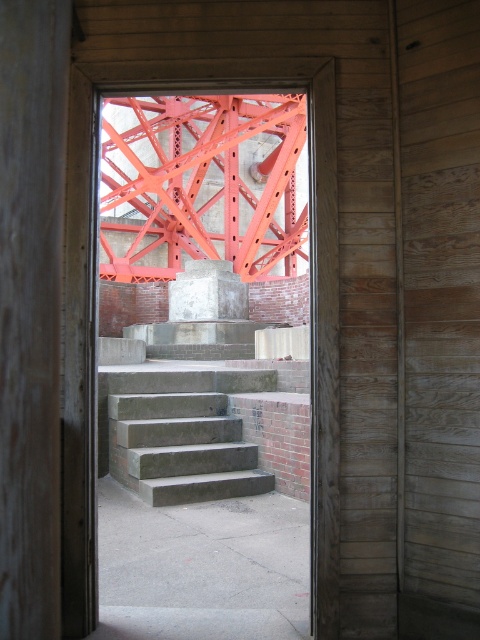
Can you confirm if bright orange steel structure at center is wider than concrete stairs at center?

Indeed, bright orange steel structure at center has a greater width compared to concrete stairs at center.

Is point (240, 248) in front of point (333, 234)?

No, (240, 248) is further to viewer.

The image size is (480, 640). Find the location of `bright orange steel structure at center`. bright orange steel structure at center is located at coordinates (203, 184).

Can you confirm if concrete stairs at center is wider than concrete at center?

No.

Does point (91, 227) come in front of point (179, 310)?

Yes, it is.

Where is `concrete stairs at center`? The image size is (480, 640). concrete stairs at center is located at coordinates (311, 307).

Between bright orange steel structure at center and concrete at center, which one has less height?

concrete at center is shorter.

Is bright orange steel structure at center positioned at the back of concrete at center?

No, it is not.

Between point (159, 218) and point (206, 300), which one is positioned in front?

Point (206, 300) is in front.

This screenshot has height=640, width=480. I want to click on bright orange steel structure at center, so click(203, 184).